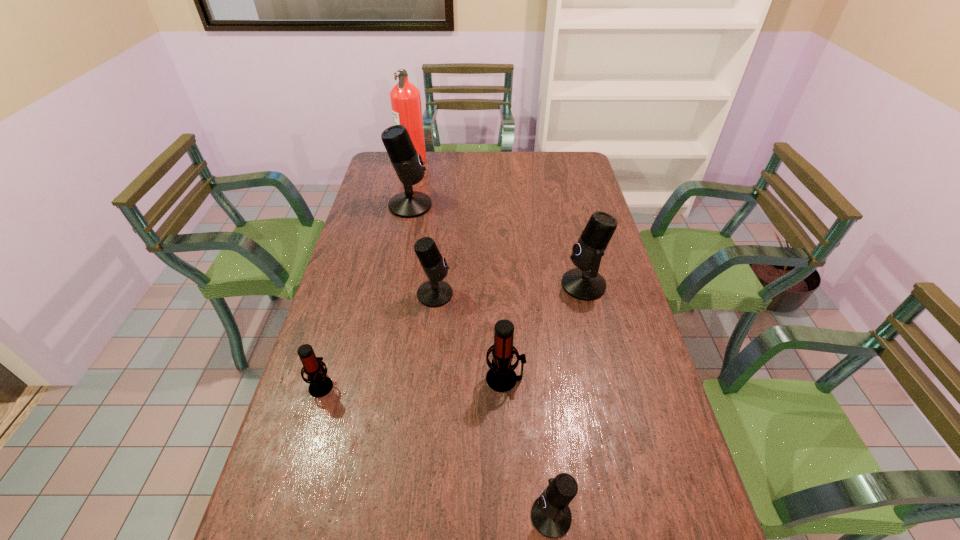
The width and height of the screenshot is (960, 540). I want to click on empty location between the second black microphone from right to left and the right red microphone, so click(x=528, y=447).

You are a GUI agent. You are given a task and a screenshot of the screen. Output one action in this format:
    pyautogui.click(x=<x>, y=<y>)
    Task: Click on the free space between the rightmost microphone and the leftmost object
    
    Given the screenshot: What is the action you would take?
    452,335

You are a GUI agent. You are given a task and a screenshot of the screen. Output one action in this format:
    pyautogui.click(x=<x>, y=<y>)
    Task: Click on the object that stands as the fourth closest to the third biggest black microphone
    This screenshot has height=540, width=960.
    Given the screenshot: What is the action you would take?
    pos(584,283)

Locate an element on the screen. The width and height of the screenshot is (960, 540). the fifth closest object to the farthest microphone is located at coordinates (501, 377).

This screenshot has height=540, width=960. What are the coordinates of `microphone that is the fifth closest to the third biggest black microphone` in the screenshot? It's located at (551, 516).

Where is `microphone identified as the second closest to the second biggest black microphone`? This screenshot has height=540, width=960. microphone identified as the second closest to the second biggest black microphone is located at coordinates (434, 293).

Identify which black microphone is located as the second nearest to the farthest microphone. Please provide its 2D coordinates. Your answer should be formatted as a tuple, i.e. [(x, y)], where the tuple contains the x and y coordinates of a point satisfying the conditions above.

[(584, 283)]

Find the location of a particular element. The image size is (960, 540). black microphone object that ranks as the third closest to the third biggest black microphone is located at coordinates (551, 516).

Find the location of a particular element. The image size is (960, 540). vacant space that satisfies the following two spatial constraints: 1. on the stand of the biggest black microphone; 2. on the back side of the right red microphone is located at coordinates (376, 379).

Locate an element on the screen. vacant position in the image that satisfies the following two spatial constraints: 1. on the stand of the sixth shortest object; 2. on the right side of the right red microphone is located at coordinates (376, 379).